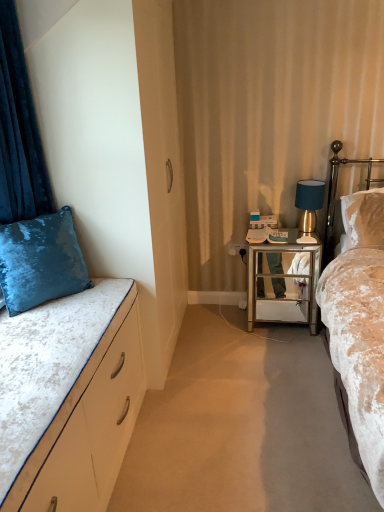
Question: Can velvet beige bed at right, which appears as the 1th bed when viewed from the right, be found inside white glossy power outlet at center?

Choices:
 (A) no
 (B) yes

Answer: (A)

Question: From the image's perspective, is white glossy power outlet at center located beneath velvet beige bed at right, the 2th bed when ordered from left to right?

Choices:
 (A) no
 (B) yes

Answer: (A)

Question: From a real-world perspective, is white glossy power outlet at center positioned under velvet beige bed at right, the 2th bed when ordered from left to right, based on gravity?

Choices:
 (A) no
 (B) yes

Answer: (B)

Question: Does white glossy power outlet at center have a greater height compared to velvet beige bed at right, which appears as the 1th bed when viewed from the right?

Choices:
 (A) yes
 (B) no

Answer: (B)

Question: Is the depth of white glossy power outlet at center less than that of velvet beige bed at right, the 2th bed when ordered from left to right?

Choices:
 (A) yes
 (B) no

Answer: (B)

Question: Looking at the image, does velvet white bed at left, the first bed viewed from the left, seem bigger or smaller compared to gold mirrored nightstand at right?

Choices:
 (A) big
 (B) small

Answer: (B)

Question: From a real-world perspective, is velvet white bed at left, the first bed viewed from the left, physically located above or below gold mirrored nightstand at right?

Choices:
 (A) above
 (B) below

Answer: (A)

Question: Is velvet white bed at left, the first bed viewed from the left, wider or thinner than gold mirrored nightstand at right?

Choices:
 (A) thin
 (B) wide

Answer: (B)

Question: Visually, is velvet white bed at left, the first bed viewed from the left, positioned to the left or to the right of gold mirrored nightstand at right?

Choices:
 (A) right
 (B) left

Answer: (B)

Question: Considering the positions of velvet white bed at left, the second bed viewed from the right, and white glossy power outlet at center in the image, is velvet white bed at left, the second bed viewed from the right, taller or shorter than white glossy power outlet at center?

Choices:
 (A) short
 (B) tall

Answer: (B)

Question: From a real-world perspective, is velvet white bed at left, the first bed viewed from the left, physically located above or below white glossy power outlet at center?

Choices:
 (A) above
 (B) below

Answer: (A)

Question: In terms of size, does velvet white bed at left, the first bed viewed from the left, appear bigger or smaller than white glossy power outlet at center?

Choices:
 (A) small
 (B) big

Answer: (B)

Question: From the image's perspective, is velvet white bed at left, the first bed viewed from the left, located above or below white glossy power outlet at center?

Choices:
 (A) below
 (B) above

Answer: (A)

Question: From the image's perspective, is velvet blue pillow at left above or below white glossy power outlet at center?

Choices:
 (A) below
 (B) above

Answer: (A)

Question: From a real-world perspective, is velvet blue pillow at left positioned above or below white glossy power outlet at center?

Choices:
 (A) above
 (B) below

Answer: (A)